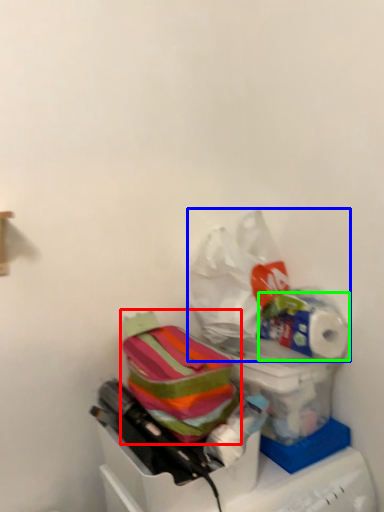
Question: Which object is positioned closest to material (highlighted by a red box)? Select from plastic bag (highlighted by a blue box) and toilet paper (highlighted by a green box).

Choices:
 (A) plastic bag
 (B) toilet paper

Answer: (A)